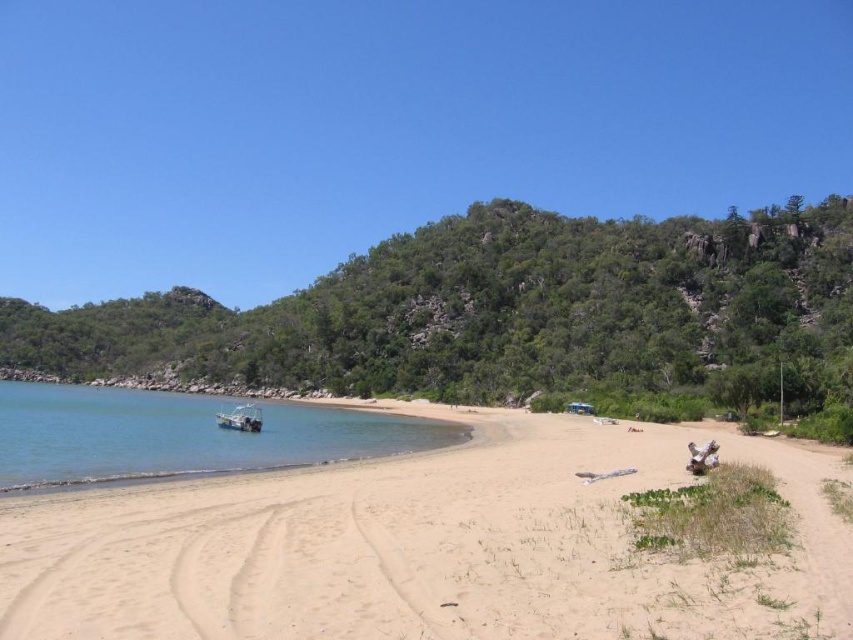
Question: Can you confirm if light beige sand at lower center is positioned to the left of clear water at lower left?

Choices:
 (A) no
 (B) yes

Answer: (A)

Question: Can you confirm if light beige sand at lower center is positioned below metallic silver boat at lower left?

Choices:
 (A) yes
 (B) no

Answer: (B)

Question: Is clear water at lower left to the right of metallic silver boat at lower left from the viewer's perspective?

Choices:
 (A) no
 (B) yes

Answer: (A)

Question: Considering the real-world distances, which object is closest to the clear water at lower left?

Choices:
 (A) light beige sand at lower center
 (B) metallic silver boat at lower left

Answer: (B)

Question: Estimate the real-world distances between objects in this image. Which object is farther from the clear water at lower left?

Choices:
 (A) metallic silver boat at lower left
 (B) light beige sand at lower center

Answer: (B)

Question: Which of the following is the farthest from the observer?

Choices:
 (A) metallic silver boat at lower left
 (B) clear water at lower left

Answer: (A)